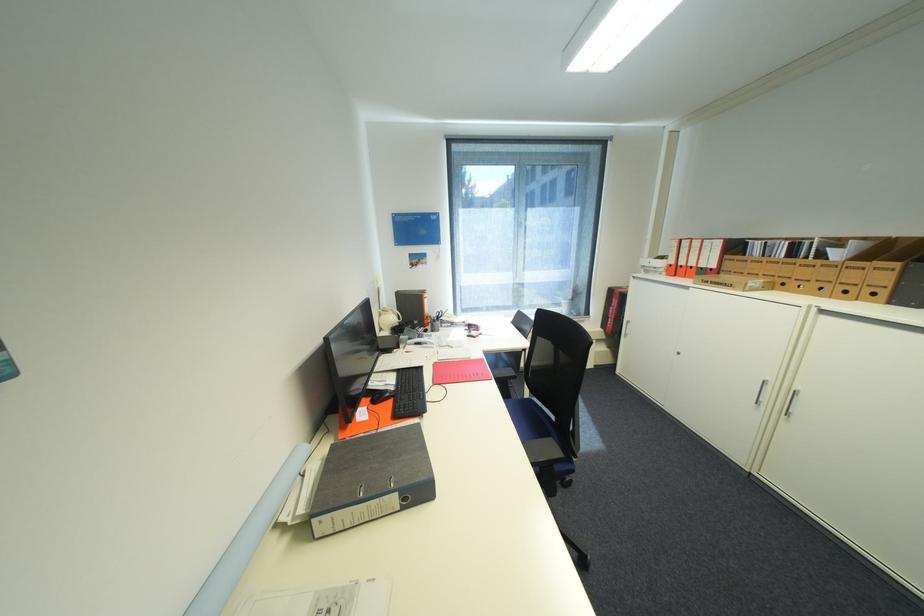
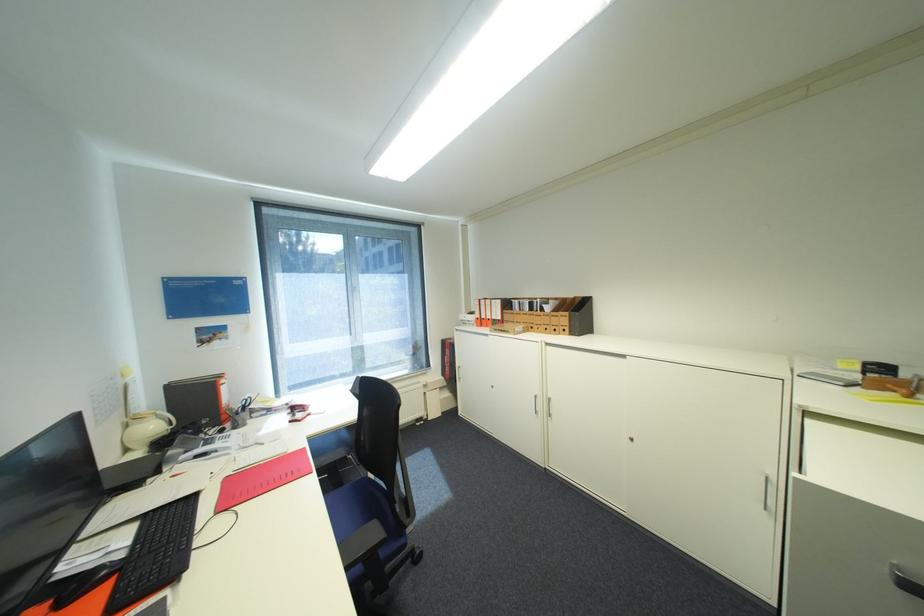
The point at (444, 365) is marked in the first image. Where is the corresponding point in the second image?

(235, 480)